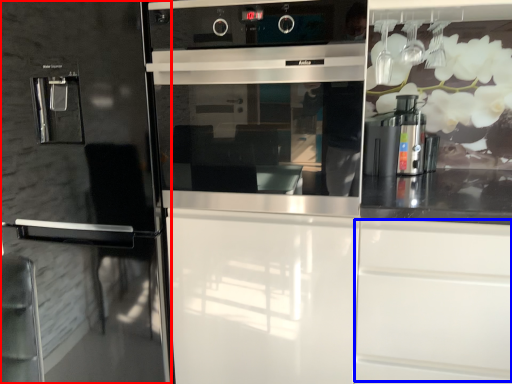
Question: Which object appears farthest to the camera in this image, fridge (highlighted by a red box) or drawer (highlighted by a blue box)?

Choices:
 (A) fridge
 (B) drawer

Answer: (A)